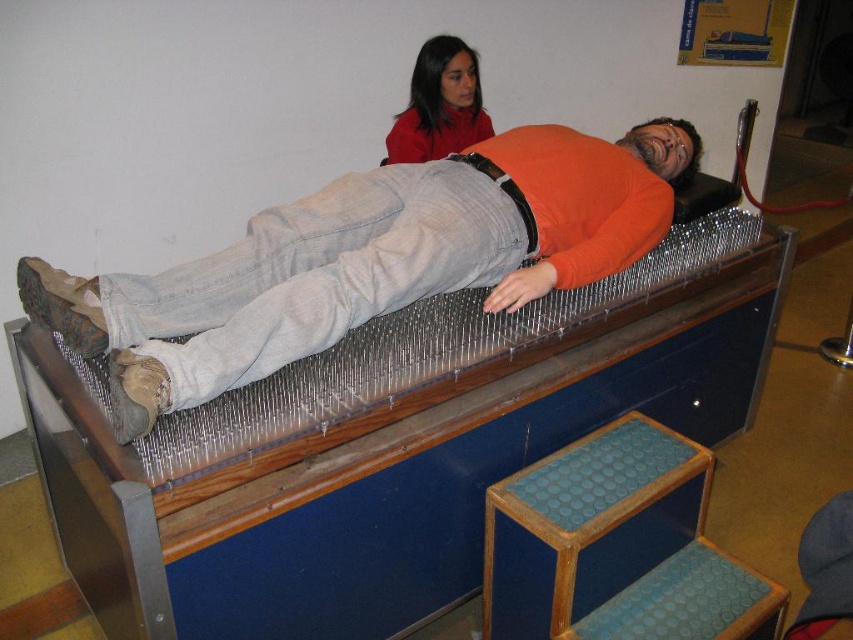
Question: Which object is the closest to the blue rubberized step at lower right?

Choices:
 (A) wooden bed frame at center
 (B) orange matte shirt at center

Answer: (A)

Question: Can you confirm if orange matte shirt at center is thinner than matte red sweater at upper center?

Choices:
 (A) yes
 (B) no

Answer: (B)

Question: Among these points, which one is nearest to the camera?

Choices:
 (A) (550, 612)
 (B) (357, 406)

Answer: (B)

Question: Which point is closer to the camera?

Choices:
 (A) (300, 541)
 (B) (607, 509)
 (C) (105, 276)

Answer: (A)

Question: Does blue rubberized step at lower right have a smaller size compared to matte red sweater at upper center?

Choices:
 (A) yes
 (B) no

Answer: (B)

Question: Can you confirm if orange matte shirt at center is wider than matte red sweater at upper center?

Choices:
 (A) yes
 (B) no

Answer: (A)